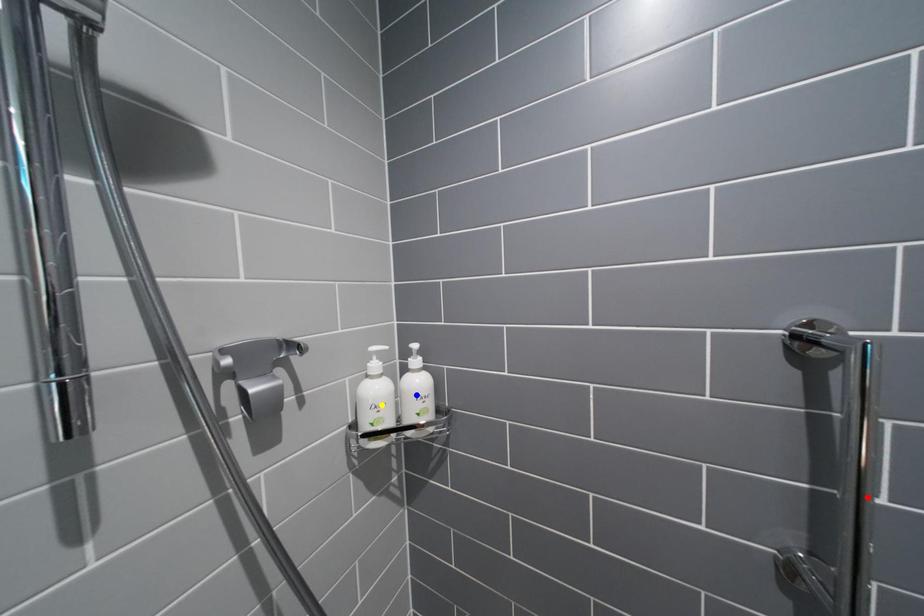
Order these from nearest to farthest:
yellow point
red point
blue point

blue point, yellow point, red point